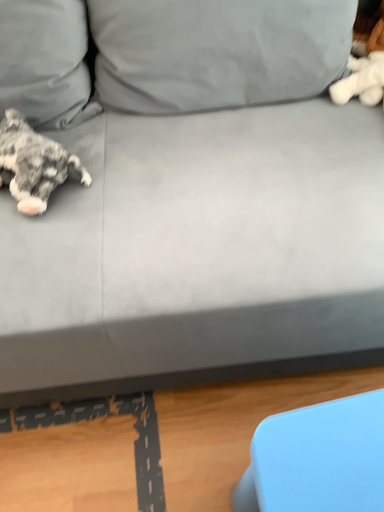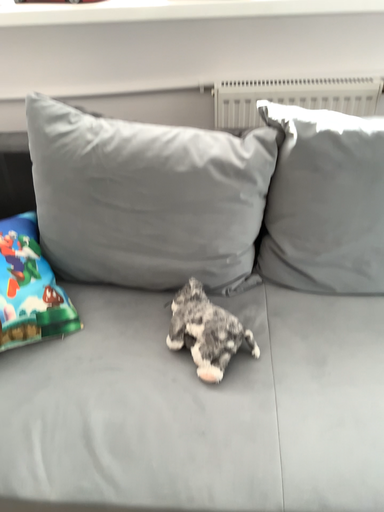
Question: Which way did the camera rotate in the video?

Choices:
 (A) rotated upward
 (B) rotated downward

Answer: (A)